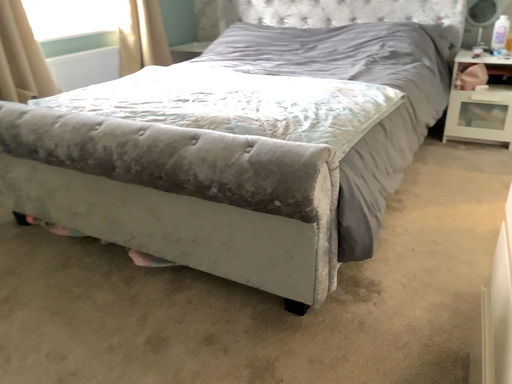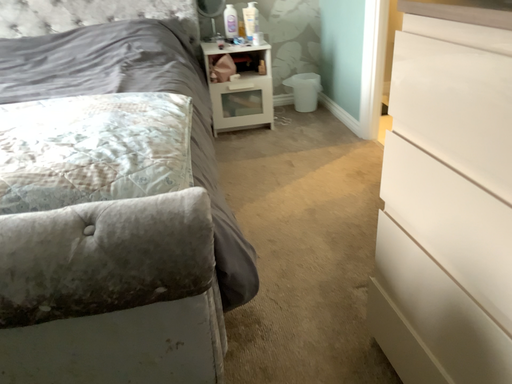
Question: Which way did the camera rotate in the video?

Choices:
 (A) rotated right
 (B) rotated left

Answer: (A)